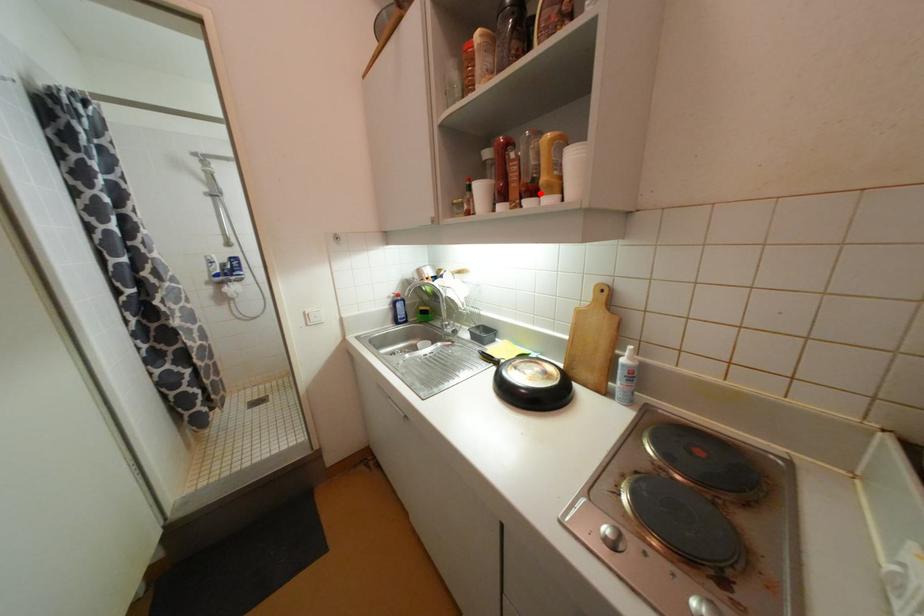
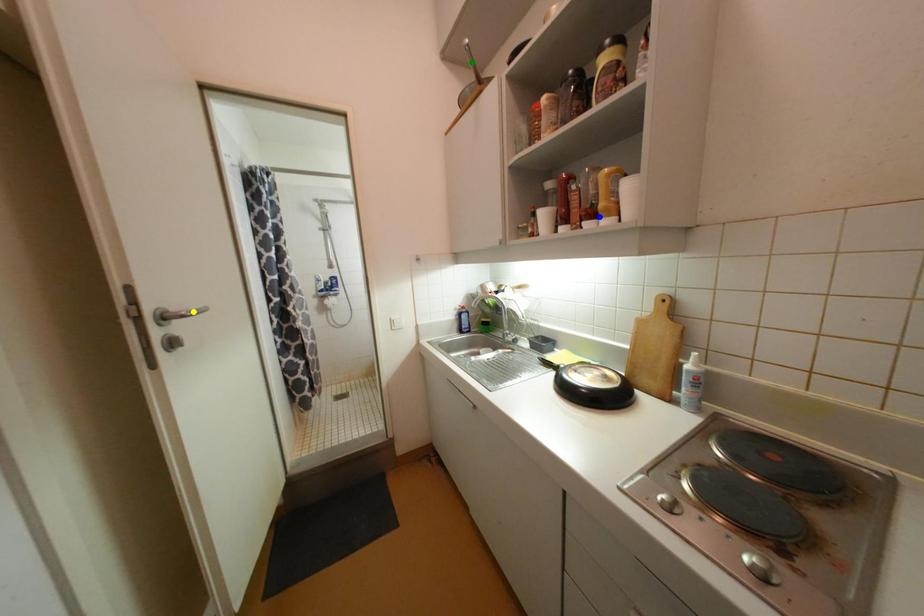
Question: I am providing you with two images of the same scene from different viewpoints. A red point is marked on the first image. You are given multiple points on the second image. In image 2, which mark is for the same physical point as the one in image 1?

Choices:
 (A) blue point
 (B) yellow point
 (C) green point

Answer: (A)